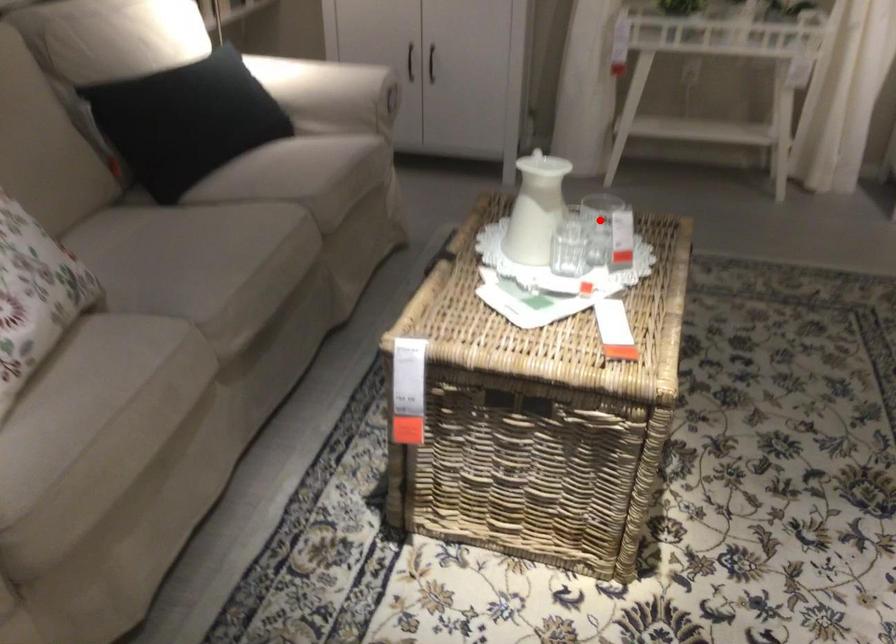
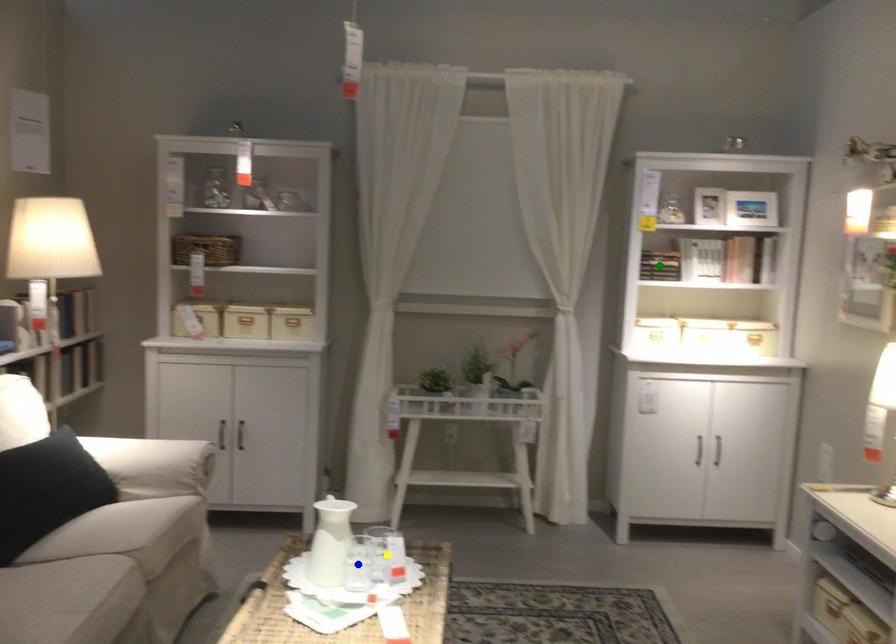
Question: I am providing you with two images of the same scene from different viewpoints. A red point is marked on the first image. You are given multiple points on the second image. Which mark in image 2 goes with the point in image 1?

Choices:
 (A) yellow point
 (B) green point
 (C) blue point

Answer: (A)